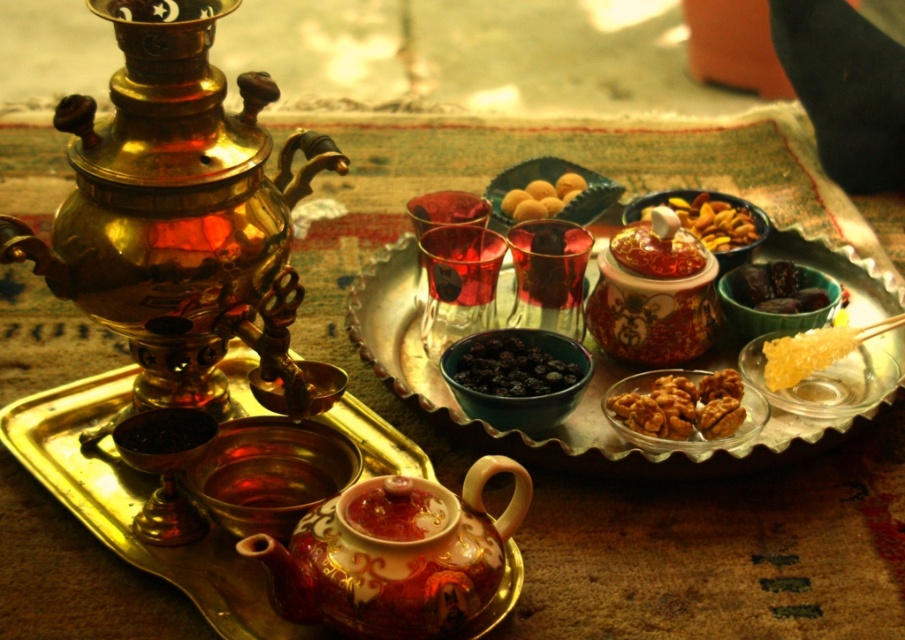
Question: Observing the image, what is the correct spatial positioning of shiny brass teapot at left in reference to red glossy teapot at center?

Choices:
 (A) above
 (B) below

Answer: (A)

Question: Can you confirm if red glossy teapot at center is wider than shiny glass teacup at center?

Choices:
 (A) yes
 (B) no

Answer: (A)

Question: Which object is closer to the camera taking this photo?

Choices:
 (A) shiny brass teapot at left
 (B) red glossy teapot at center

Answer: (A)

Question: Is shiny ceramic teapot at center positioned at the back of smooth golden nuts at center?

Choices:
 (A) yes
 (B) no

Answer: (B)

Question: Estimate the real-world distances between objects in this image. Which object is closer to the shiny brass teapot at left?

Choices:
 (A) blueberrysmoothfruit at center
 (B) shiny dark chocolate at center

Answer: (A)

Question: Which object is farther from the camera taking this photo?

Choices:
 (A) blueberrysmoothfruit at center
 (B) shiny golden nuts at center

Answer: (B)